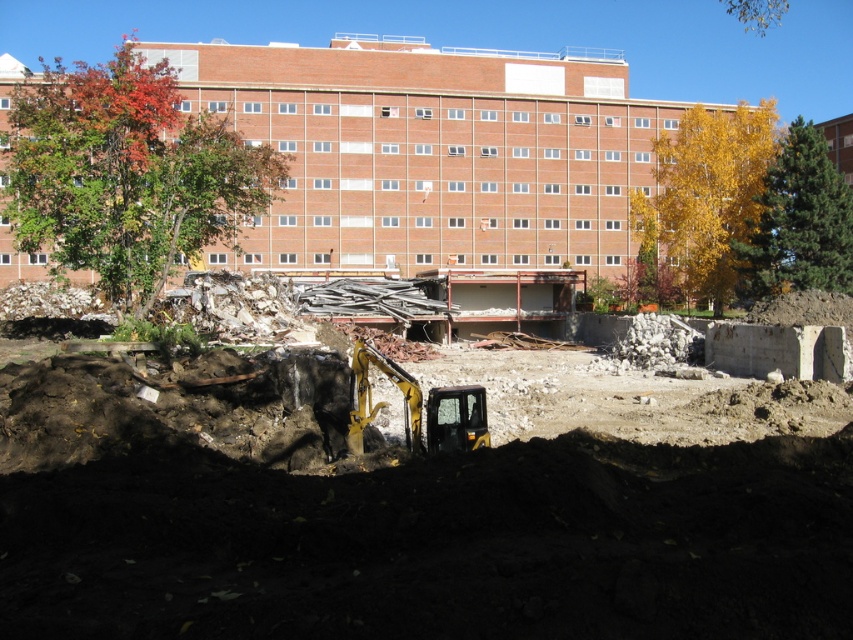
Question: Is autumn leaves at upper left behind yellow-green foliage at upper right?

Choices:
 (A) yes
 (B) no

Answer: (B)

Question: Does yellow-green foliage at upper right have a greater width compared to yellow metallic excavator at center?

Choices:
 (A) yes
 (B) no

Answer: (A)

Question: Among these objects, which one is farthest from the camera?

Choices:
 (A) yellow leafy tree at right
 (B) yellow-green foliage at upper right
 (C) yellow metallic excavator at center

Answer: (A)

Question: Which point is farther to the camera?

Choices:
 (A) (730, 253)
 (B) (799, 154)
 (C) (106, 109)

Answer: (A)

Question: Among these objects, which one is farthest from the camera?

Choices:
 (A) yellow metallic excavator at center
 (B) yellow-green foliage at upper right
 (C) autumn leaves at upper left

Answer: (B)

Question: Is autumn leaves at upper left positioned behind yellow leafy tree at right?

Choices:
 (A) yes
 (B) no

Answer: (B)